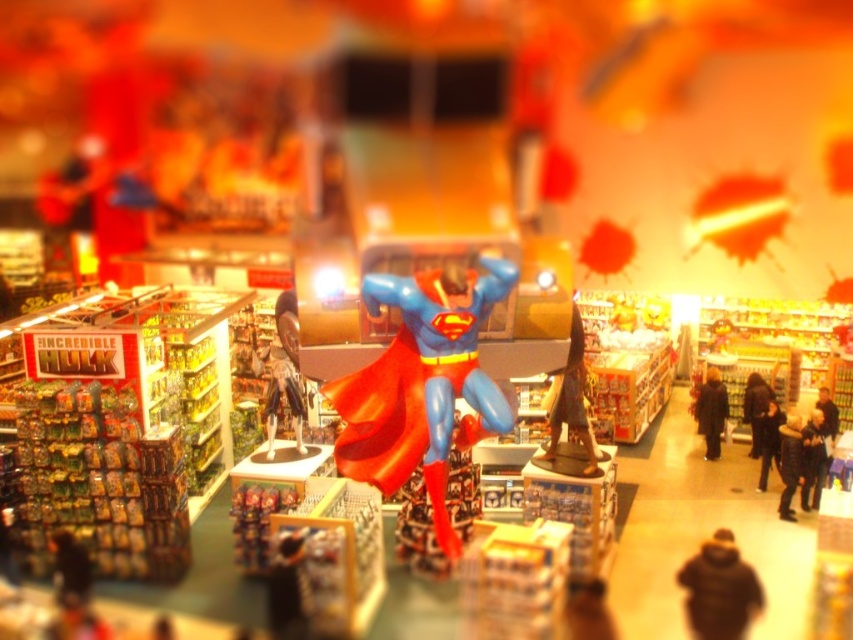
In the scene shown: Does dark brown fur coat at center appear under shiny metallic figure at center?

Indeed, dark brown fur coat at center is positioned under shiny metallic figure at center.

Can you confirm if dark brown fur coat at center is positioned to the left of shiny metallic figure at center?

No, dark brown fur coat at center is not to the left of shiny metallic figure at center.

In order to click on dark brown fur coat at center in this screenshot , I will do (718, 588).

I want to click on dark brown fur coat at center, so click(x=718, y=588).

Looking at this image, who is lower down, bronze statue at center or dark brown leather jacket at center?

dark brown leather jacket at center

Between point (572, 346) and point (755, 426), which one is positioned in front?

Point (572, 346)

Does point (547, 392) come in front of point (746, 384)?

Yes, point (547, 392) is closer to viewer.

The height and width of the screenshot is (640, 853). In order to click on bronze statue at center in this screenshot , I will do `click(570, 400)`.

The height and width of the screenshot is (640, 853). What do you see at coordinates (718, 588) in the screenshot?
I see `dark brown fur coat at center` at bounding box center [718, 588].

Between dark brown fur coat at center and black wool coat at center, which one has less height?

dark brown fur coat at center is shorter.

The image size is (853, 640). Identify the location of dark brown fur coat at center. tap(718, 588).

What are the coordinates of `dark brown fur coat at center` in the screenshot? It's located at (718, 588).